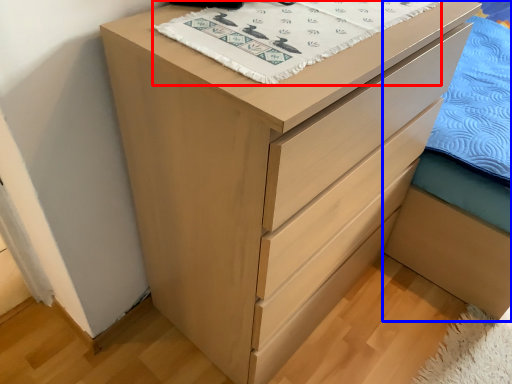
Question: Which of the following is the closest to the observer, blanket (highlighted by a red box) or bed frame (highlighted by a blue box)?

Choices:
 (A) blanket
 (B) bed frame

Answer: (A)